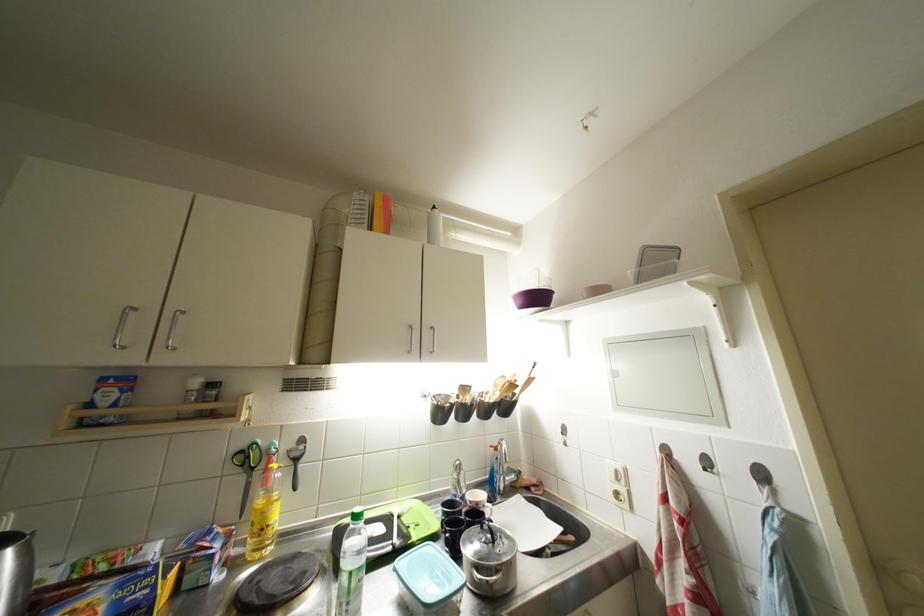
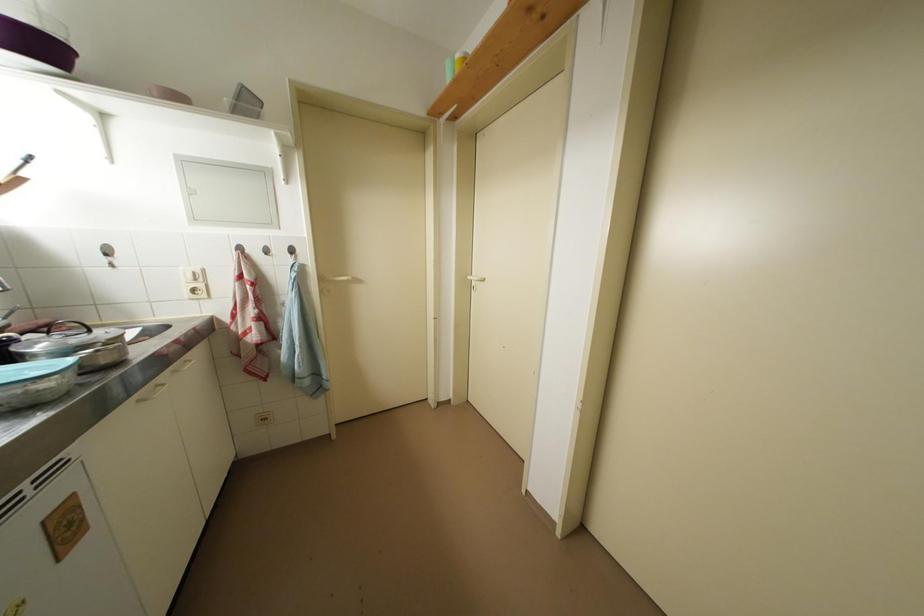
Question: How did the camera likely rotate?

Choices:
 (A) Left
 (B) Right
 (C) Up
 (D) Down

Answer: (B)